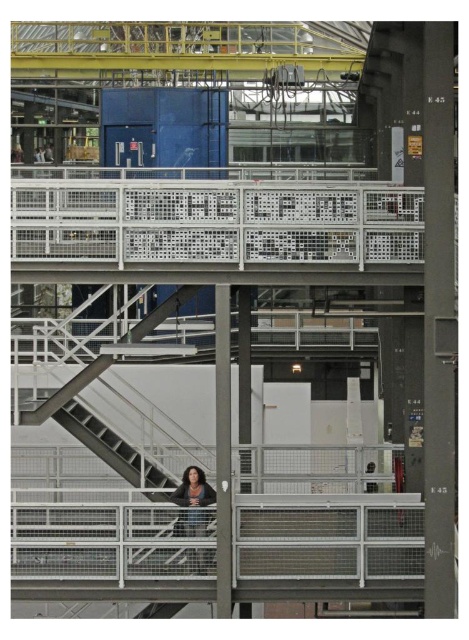
Is dark brown leather jacket at center smaller than dark brown leather jacket at lower center?

Incorrect, dark brown leather jacket at center is not smaller in size than dark brown leather jacket at lower center.

Does dark brown leather jacket at center appear over dark brown leather jacket at lower center?

No.

Who is more distant from viewer, (x=181, y=493) or (x=375, y=483)?

Positioned behind is point (x=375, y=483).

Image resolution: width=469 pixels, height=640 pixels. Find the location of `dark brown leather jacket at center`. dark brown leather jacket at center is located at coordinates [193, 502].